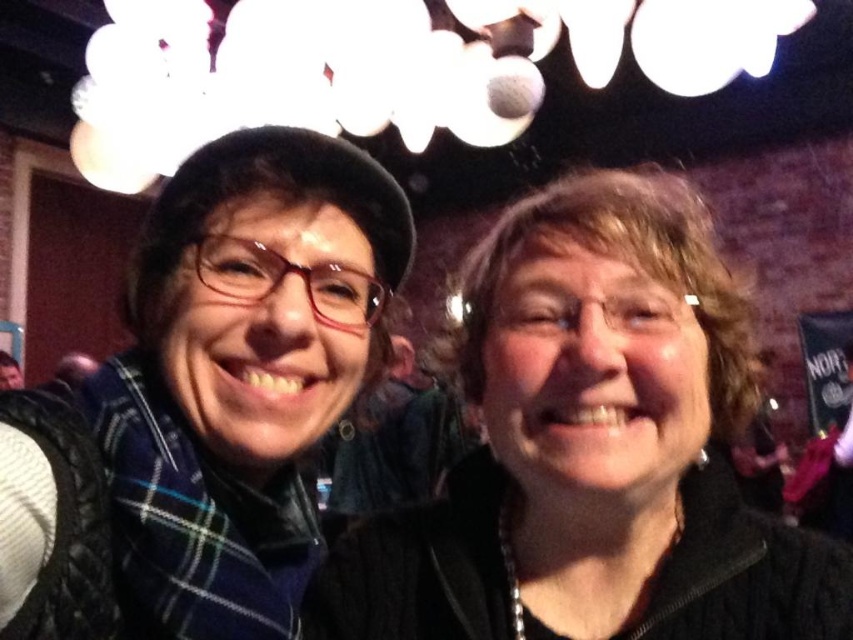
Which of these two, black matte jacket at center or plaid scarf at left, stands taller?

With more height is plaid scarf at left.

Consider the image. Is black matte jacket at center smaller than plaid scarf at left?

Correct, black matte jacket at center occupies less space than plaid scarf at left.

What do you see at coordinates (592, 449) in the screenshot? I see `black matte jacket at center` at bounding box center [592, 449].

This screenshot has width=853, height=640. In order to click on black matte jacket at center in this screenshot , I will do `click(592, 449)`.